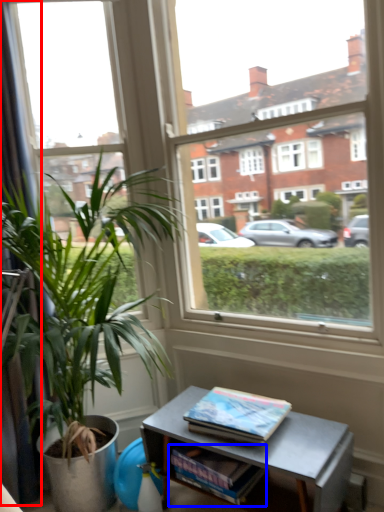
Question: Which object is further to the camera taking this photo, curtain (highlighted by a red box) or magazine (highlighted by a blue box)?

Choices:
 (A) curtain
 (B) magazine

Answer: (A)